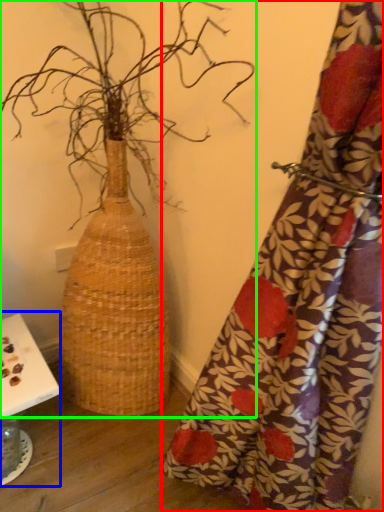
Question: Which object is positioned farthest from curtain (highlighted by a red box)? Select from table (highlighted by a blue box) and houseplant (highlighted by a green box).

Choices:
 (A) table
 (B) houseplant

Answer: (A)